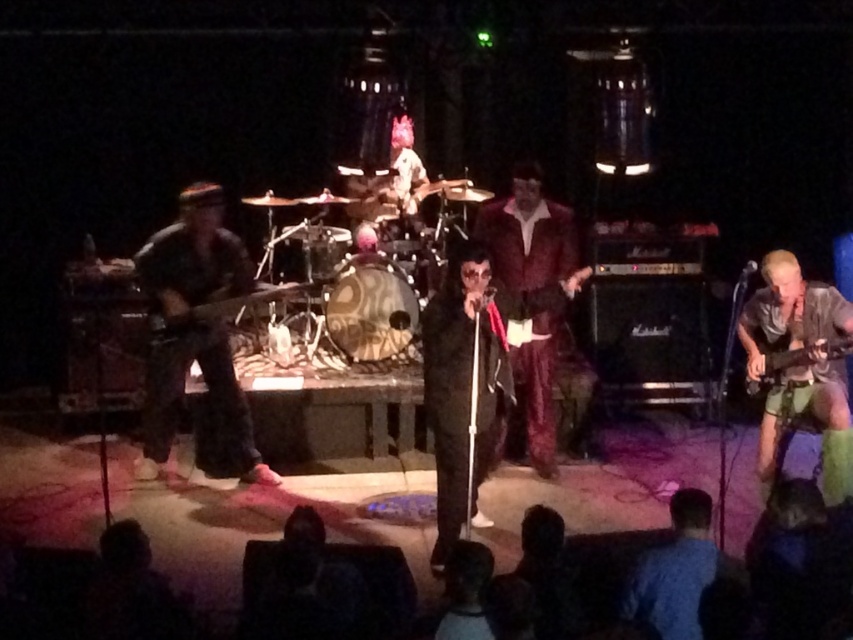
You are a photographer at the back of the venue. You want to take a photo of the metallic silver guitar at right and the denim shorts at right. Which object will appear closer to the camera in the photo?

The denim shorts at right will appear closer to the camera in the photo because the metallic silver guitar at right is behind it.

Consider the image. You are a stagehand setting up for a concert and need to adjust the height of the guitar stands. Given the camouflage fabric guitar at left and the wooden electric guitar at center, which guitar requires a taller stand?

The camouflage fabric guitar at left requires a taller stand since it has a greater height compared to the wooden electric guitar at center.

You are a photographer at the concert venue. You need to capture a closeup shot of the denim shorts at right. The camera you are using has a focal length of 100mm. Given that the point corresponding to the denim shorts at right is located at coordinates point (799, 368), can you determine if this focal length will allow you to frame the denim shorts at right properly?

The point (799, 368) corresponds to denim shorts at right, so using a 100mm focal length should allow the photographer to frame the denim shorts at right properly as it is suitable for closeup shots.